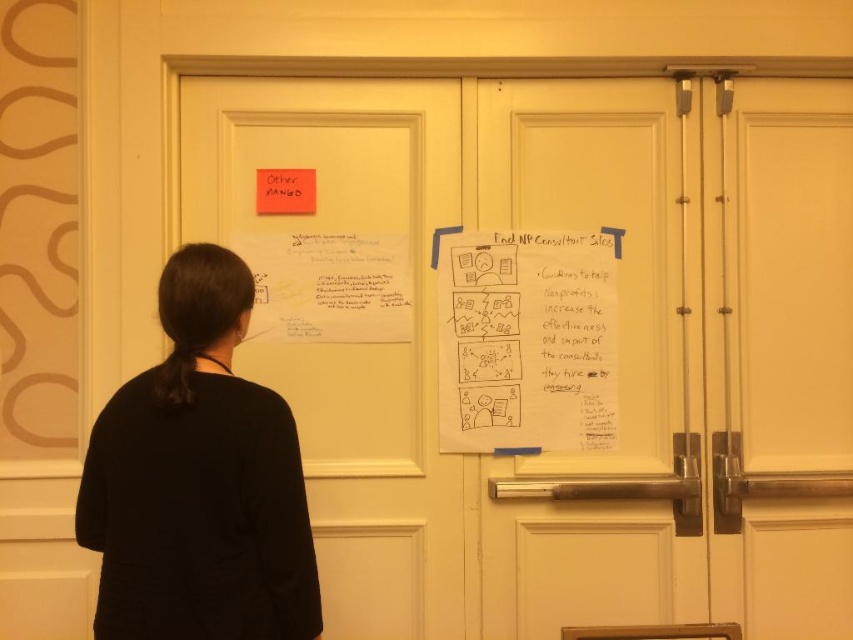
You are a delivery person standing in front of the white matte door at center. You need to deliver a package that requires you to be exactly 2 meters away from the door to scan it. Can you adjust your position to meet this requirement?

The white matte door at center is currently 2.31 meters away from you. To meet the requirement of being exactly 2 meters away, you need to move closer by 0.31 meters.